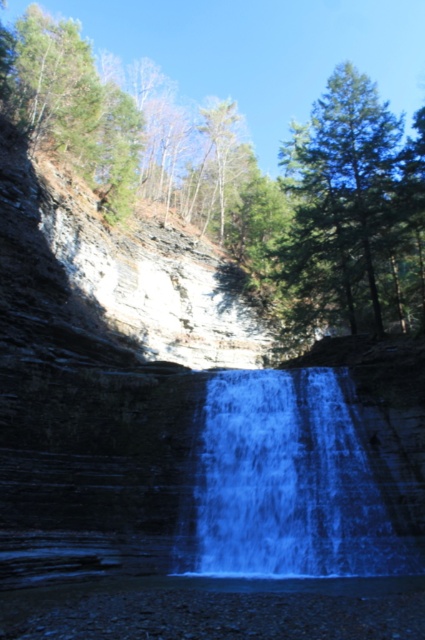
Who is lower down, green leafy tree at upper center or blue translucent water at center?

Positioned lower is blue translucent water at center.

Is point (93, 67) positioned behind point (410, 470)?

Yes, point (93, 67) is behind point (410, 470).

The height and width of the screenshot is (640, 425). Identify the location of green leafy tree at upper center. (266, 188).

Between green leafy tree at upper center and green matte tree at upper right, which one appears on the right side from the viewer's perspective?

green matte tree at upper right

Looking at this image, does green leafy tree at upper center appear on the left side of green matte tree at upper right?

Correct, you'll find green leafy tree at upper center to the left of green matte tree at upper right.

Does point (308, 172) come farther from viewer compared to point (351, 330)?

Yes, it is.

I want to click on green leafy tree at upper center, so click(x=266, y=188).

Between point (397, 458) and point (377, 136), which one is positioned behind?

The point (377, 136) is more distant.

Image resolution: width=425 pixels, height=640 pixels. Identify the location of blue translucent water at center. (297, 483).

Is point (422, 531) farther from camera compared to point (299, 216)?

No.

This screenshot has width=425, height=640. I want to click on blue translucent water at center, so click(297, 483).